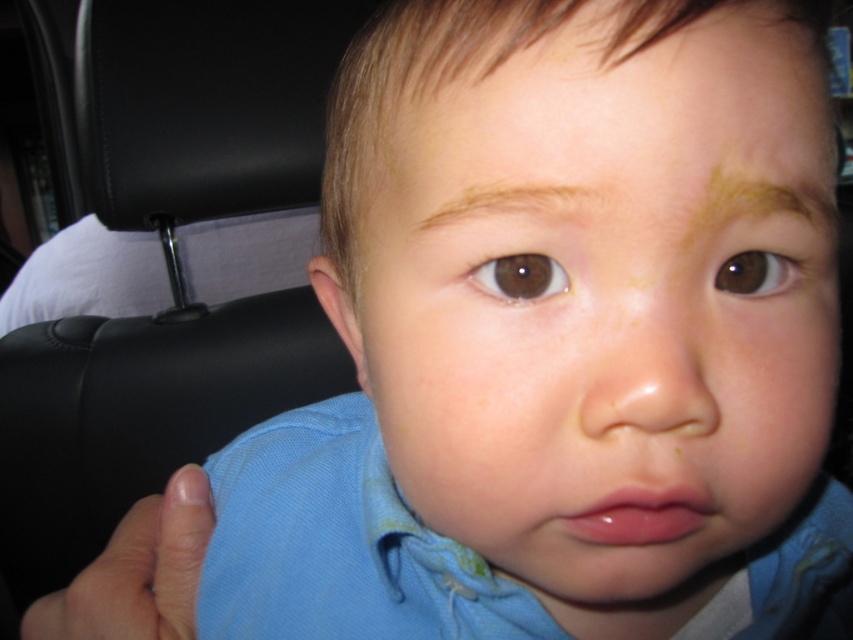
Which is in front, point (561, 289) or point (759, 253)?

Point (561, 289) is more forward.

Does point (514, 288) come farther from viewer compared to point (764, 257)?

No, it is in front of (764, 257).

At what (x,y) coordinates should I click in order to perform the action: click on brown matte eye at center. Please return your answer as a coordinate pair (x, y). Looking at the image, I should click on click(521, 276).

Is smooth skin face at center to the left of brown smooth eyebrow at upper center from the viewer's perspective?

No, smooth skin face at center is not to the left of brown smooth eyebrow at upper center.

Does smooth skin face at center have a lesser height compared to brown smooth eyebrow at upper center?

In fact, smooth skin face at center may be taller than brown smooth eyebrow at upper center.

Locate an element on the screen. smooth skin face at center is located at coordinates (602, 307).

Who is lower down, smooth skin nose at center or brown smooth eyebrow at upper center?

smooth skin nose at center is lower down.

Which is in front, point (622, 403) or point (509, 196)?

Point (622, 403) is in front.

The image size is (853, 640). What are the coordinates of `smooth skin nose at center` in the screenshot? It's located at (648, 387).